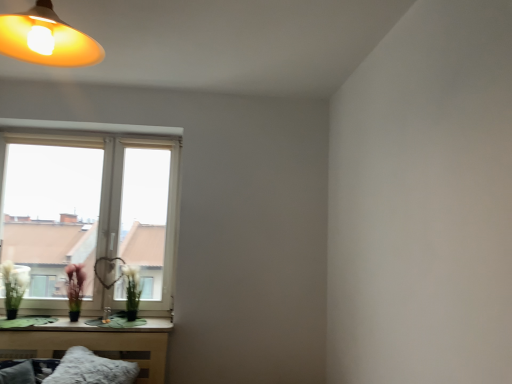
Question: In terms of size, does green matte vase at lower left appear bigger or smaller than green matte flower at lower left, acting as the 1th flower starting from the left?

Choices:
 (A) big
 (B) small

Answer: (A)

Question: In the image, is green matte vase at lower left positioned in front of or behind green matte flower at lower left, which is the 2th flower from right to left?

Choices:
 (A) front
 (B) behind

Answer: (A)

Question: Estimate the real-world distances between objects in this image. Which object is farther from the green matte flower at lower left, which is the 2th flower from right to left?

Choices:
 (A) green matte plant at window, arranged as the 2th flower when viewed from the left
 (B) green matte vase at lower left
 (C) white plastic window at lower left
 (D) fuzzy white pillow at lower left

Answer: (D)

Question: Estimate the real-world distances between objects in this image. Which object is farther from the fuzzy white pillow at lower left?

Choices:
 (A) green matte flower at lower left, acting as the 1th flower starting from the left
 (B) white plastic window at lower left
 (C) green matte vase at lower left
 (D) green matte plant at window, placed as the 1th flower when sorted from right to left

Answer: (B)